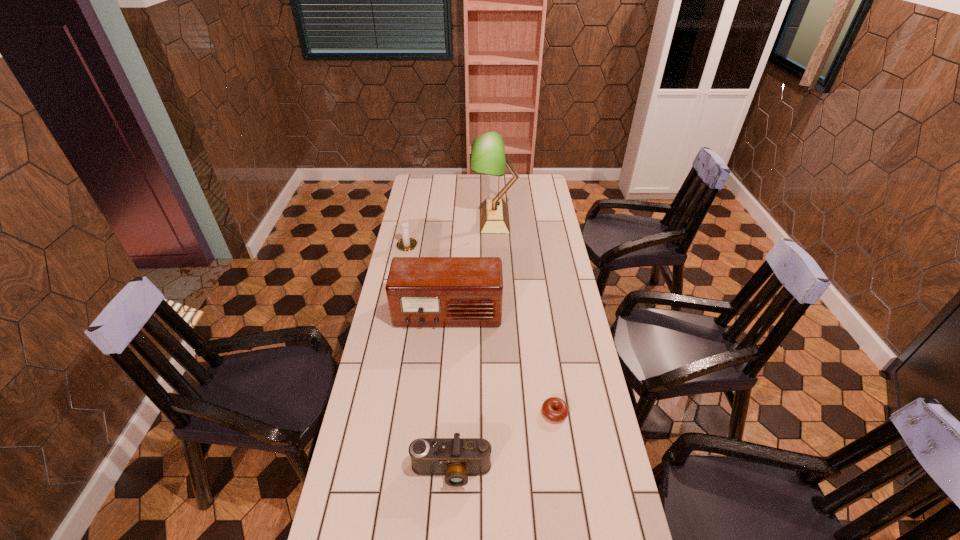
You are a GUI agent. You are given a task and a screenshot of the screen. Output one action in this format:
    pyautogui.click(x=<x>, y=<y>)
    Task: Click on the vacant region located on the metallic stand of the tallest object
    The height and width of the screenshot is (540, 960).
    Given the screenshot: What is the action you would take?
    pyautogui.click(x=453, y=219)

Image resolution: width=960 pixels, height=540 pixels. Find the location of `free spot located 0.260m on the metallic stand of the tallest object`. free spot located 0.260m on the metallic stand of the tallest object is located at coordinates (420, 219).

The width and height of the screenshot is (960, 540). Identify the location of vacant area located on the metallic stand of the tallest object. (453, 219).

Locate an element on the screen. vacant space located on the front-facing side of the second tallest object is located at coordinates (440, 426).

At what (x,y) coordinates should I click in order to perform the action: click on free location located on the handle side of the third shortest object. Please return your answer as a coordinate pair (x, y). The image size is (960, 540). Looking at the image, I should click on (416, 202).

Locate an element on the screen. The image size is (960, 540). free space located 0.340m on the handle side of the third shortest object is located at coordinates (417, 199).

You are a GUI agent. You are given a task and a screenshot of the screen. Output one action in this format:
    pyautogui.click(x=<x>, y=<y>)
    Task: Click on the free region located on the handle side of the third shortest object
    Image resolution: width=960 pixels, height=540 pixels.
    Given the screenshot: What is the action you would take?
    pyautogui.click(x=412, y=222)

The width and height of the screenshot is (960, 540). Find the location of `vacant space located on the lens of the second shortest object`. vacant space located on the lens of the second shortest object is located at coordinates coord(447,539).

Identify the location of vacant area situated 0.050m on the front of the rightmost object. The height and width of the screenshot is (540, 960). pos(559,440).

Where is `radio receiver at the left edge`? The image size is (960, 540). radio receiver at the left edge is located at coordinates (421, 291).